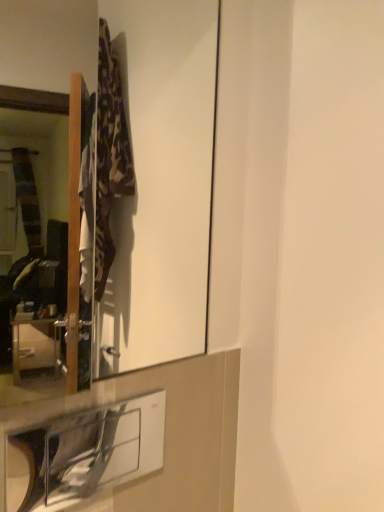
Describe the element at coordinates (161, 183) in the screenshot. I see `transparent glass door at upper left` at that location.

You are a GUI agent. You are given a task and a screenshot of the screen. Output one action in this format:
    pyautogui.click(x=<x>, y=<y>)
    Task: Click on the transparent glass door at upper left
    
    Given the screenshot: What is the action you would take?
    pyautogui.click(x=161, y=183)

Identify the location of transparent glass door at upper left. (161, 183).